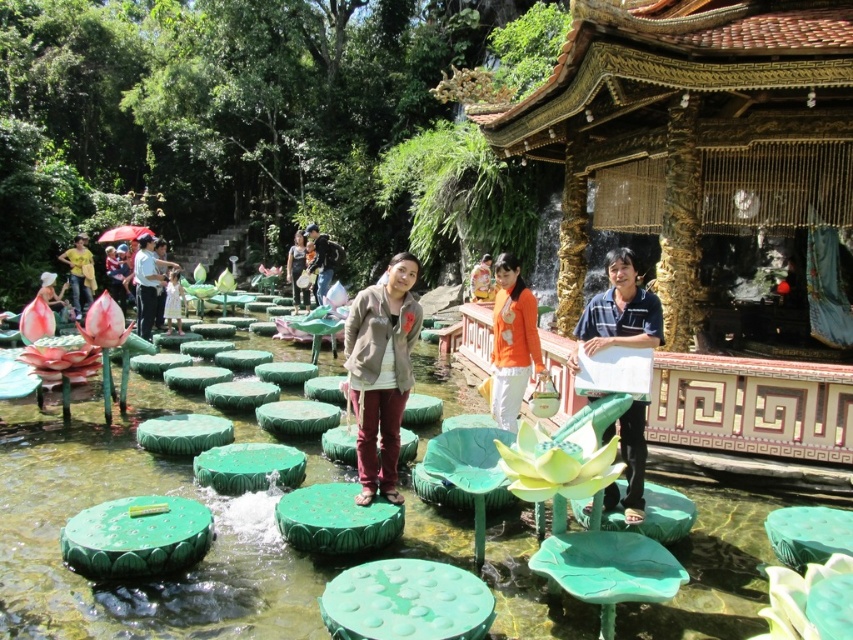
Question: Does orange fabric shirt at center appear under matte gray shirt at center?

Choices:
 (A) no
 (B) yes

Answer: (B)

Question: Does matte gray jacket at center have a larger size compared to orange fabric shirt at center?

Choices:
 (A) yes
 (B) no

Answer: (A)

Question: Which point appears farthest from the camera in this image?

Choices:
 (A) (370, 330)
 (B) (509, 321)

Answer: (B)

Question: Among these points, which one is farthest from the camera?

Choices:
 (A) (76, 298)
 (B) (390, 324)
 (C) (300, 260)
 (D) (532, 326)

Answer: (C)

Question: Which point is closer to the camera?

Choices:
 (A) orange fabric shirt at center
 (B) yellow matte shirt at center
 (C) matte black shirt at center

Answer: (C)

Question: Observing the image, what is the correct spatial positioning of matte gray jacket at center in reference to matte gray shirt at center?

Choices:
 (A) left
 (B) right

Answer: (B)